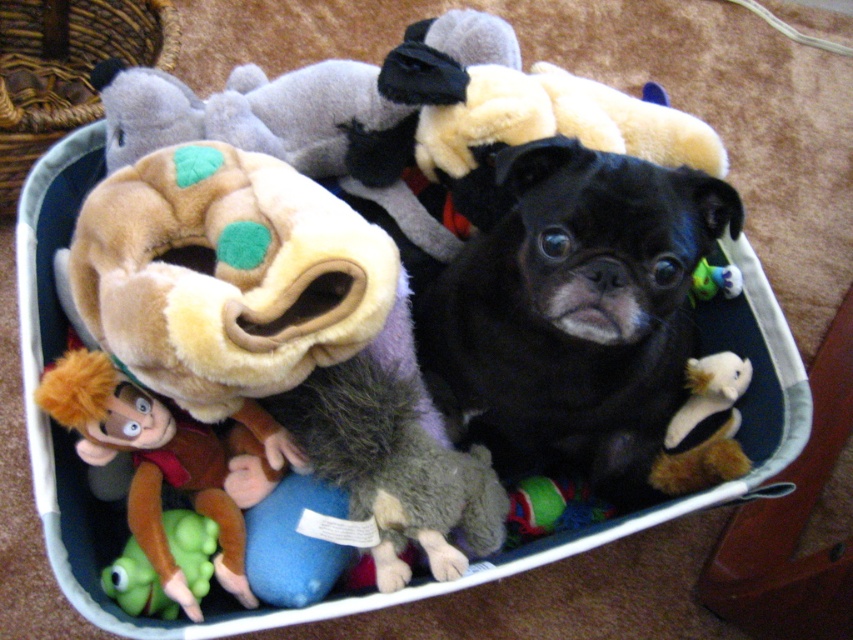
Question: Estimate the real-world distances between objects in this image. Which object is farther from the green rubber toy at lower left?

Choices:
 (A) fuzzy white plush at lower right
 (B) black soft dog at center
 (C) green plush toy at upper right

Answer: (C)

Question: Does green rubber toy at lower left lie in front of green plush toy at upper right?

Choices:
 (A) yes
 (B) no

Answer: (A)

Question: Considering the real-world distances, which object is closest to the green rubber toy at lower left?

Choices:
 (A) green plush toy at upper right
 (B) black soft dog at center
 (C) fuzzy white plush at lower right

Answer: (B)

Question: Does green rubber toy at lower left come in front of green plush toy at upper right?

Choices:
 (A) yes
 (B) no

Answer: (A)

Question: Which of these objects is positioned farthest from the fuzzy white plush at lower right?

Choices:
 (A) green plush toy at upper right
 (B) green rubber toy at lower left
 (C) black soft dog at center

Answer: (B)

Question: Does black soft dog at center lie behind fuzzy white plush at lower right?

Choices:
 (A) no
 (B) yes

Answer: (A)